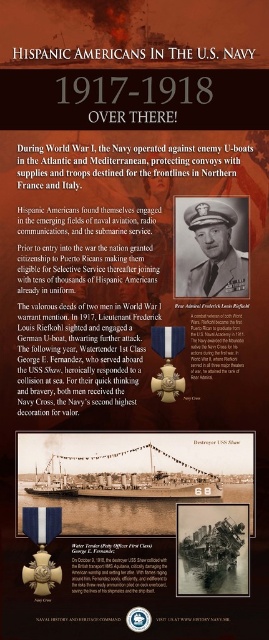
Question: Can you confirm if sepia-toned steel battleship at center is positioned to the left of wooden ship at lower left?

Choices:
 (A) no
 (B) yes

Answer: (A)

Question: Which of the following is the closest to the observer?

Choices:
 (A) matte black uniform at center
 (B) wooden ship at lower left

Answer: (B)

Question: Is sepia-toned steel battleship at center to the right of matte black uniform at center from the viewer's perspective?

Choices:
 (A) yes
 (B) no

Answer: (B)

Question: Which of the following is the closest to the observer?

Choices:
 (A) sepia-toned steel battleship at center
 (B) matte black uniform at center
 (C) wooden ship at lower left

Answer: (C)

Question: Which object is positioned farthest from the sepia-toned steel battleship at center?

Choices:
 (A) matte black uniform at center
 (B) wooden ship at lower left

Answer: (A)

Question: Is sepia-toned steel battleship at center wider than matte black uniform at center?

Choices:
 (A) no
 (B) yes

Answer: (B)